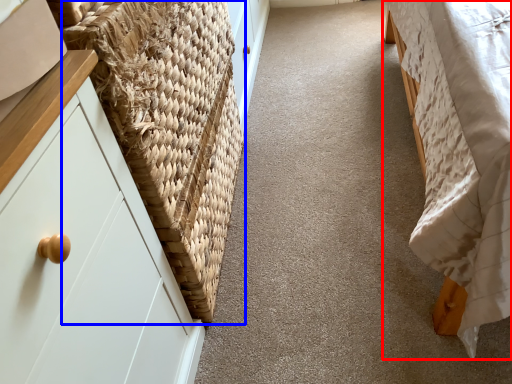
Question: Which of the following is the farthest to the observer, furniture (highlighted by a red box) or basket (highlighted by a blue box)?

Choices:
 (A) furniture
 (B) basket

Answer: (B)